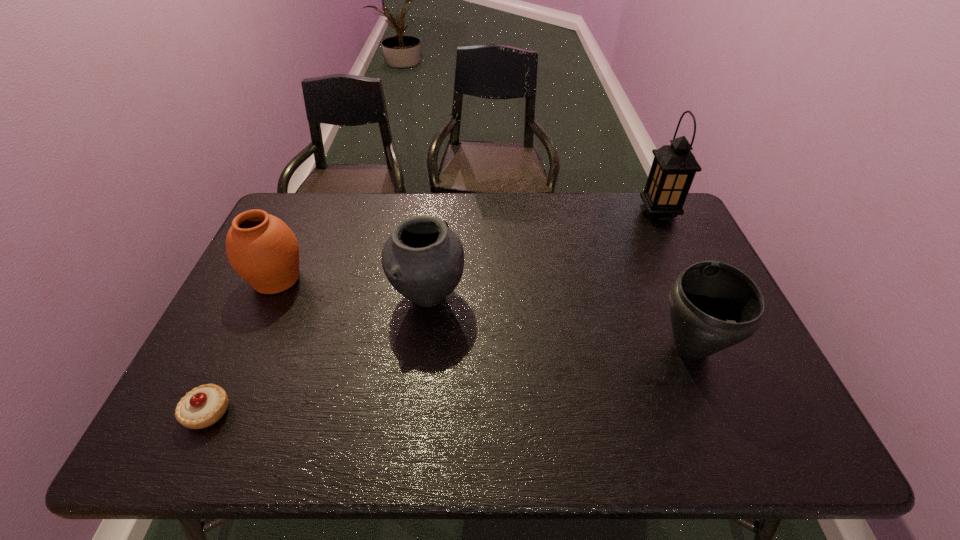
The height and width of the screenshot is (540, 960). Identify the location of empty space between the rightmost urn and the pastry. (449, 380).

Identify the location of free space between the rightmost urn and the leftmost urn. (484, 313).

At what (x,y) coordinates should I click in order to perform the action: click on unoccupied area between the rightmost urn and the lantern. Please return your answer as a coordinate pair (x, y). Image resolution: width=960 pixels, height=540 pixels. Looking at the image, I should click on [x=674, y=281].

Find the location of a particular element. The height and width of the screenshot is (540, 960). free area in between the third object from left to right and the nearest object is located at coordinates (318, 354).

Where is `object that can be found as the second closest to the rightmost urn`? The width and height of the screenshot is (960, 540). object that can be found as the second closest to the rightmost urn is located at coordinates (423, 259).

Find the location of a particular element. The width and height of the screenshot is (960, 540). the closest object to the second urn from left to right is located at coordinates (261, 248).

Locate which urn ranks second in proximity to the leftmost urn. Please provide its 2D coordinates. Your answer should be formatted as a tuple, i.e. [(x, y)], where the tuple contains the x and y coordinates of a point satisfying the conditions above.

[(713, 305)]

This screenshot has width=960, height=540. What are the coordinates of `urn that is the closest one to the leftmost urn` in the screenshot? It's located at (423, 259).

The width and height of the screenshot is (960, 540). I want to click on free location that satisfies the following two spatial constraints: 1. on the back side of the third object from right to left; 2. on the left side of the nearest object, so click(263, 296).